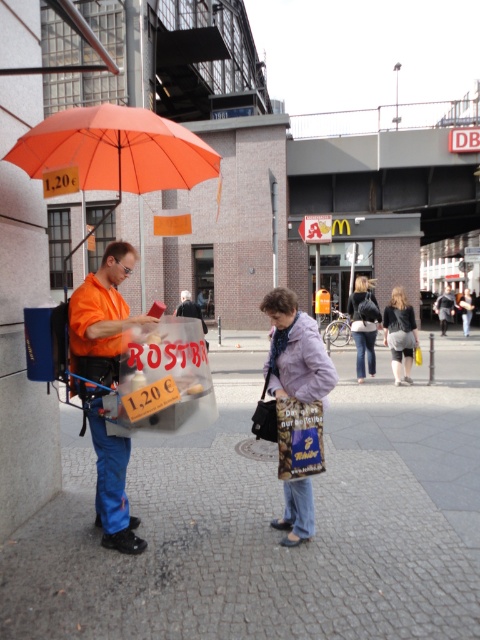
You are a fashion designer observing two jackets in a street scene. The scene shows a man under an orange umbrella selling chestnuts and a woman holding a shopping bag. Which jacket, the leather jacket at center or the dark gray fabric jacket at center, is shorter?

The leather jacket at center is shorter than the dark gray fabric jacket at center.